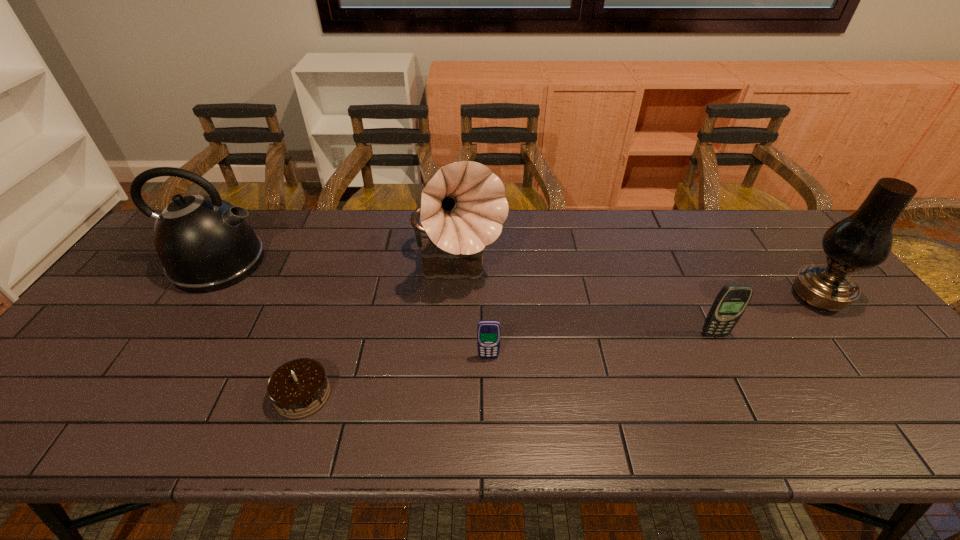
The height and width of the screenshot is (540, 960). I want to click on object at the far left corner, so click(206, 244).

In the image, there is a desktop. At what (x,y) coordinates should I click in order to perform the action: click on blank space at the far edge. Please return your answer as a coordinate pair (x, y). The height and width of the screenshot is (540, 960). Looking at the image, I should click on (289, 223).

You are a GUI agent. You are given a task and a screenshot of the screen. Output one action in this format:
    pyautogui.click(x=<x>, y=<y>)
    Task: Click on the free spot at the near edge of the desktop
    
    Given the screenshot: What is the action you would take?
    click(x=376, y=410)

Locate an element on the screen. vacant space at the left edge of the desktop is located at coordinates (74, 364).

In the image, there is a desktop. What are the coordinates of `vacant space at the right edge` in the screenshot? It's located at (850, 349).

At what (x,y) coordinates should I click in order to perform the action: click on free spot at the near left corner of the desktop. Please return your answer as a coordinate pair (x, y). This screenshot has height=540, width=960. Looking at the image, I should click on (54, 425).

The width and height of the screenshot is (960, 540). I want to click on vacant region at the near right corner of the desktop, so click(954, 430).

Find the location of a particular element. free space between the chocolate cake and the nearer cellular telephone is located at coordinates (396, 376).

Locate an element on the screen. free space between the fifth farthest object and the leftmost object is located at coordinates (353, 310).

The image size is (960, 540). I want to click on empty space between the rightmost object and the fifth object from left to right, so click(x=766, y=316).